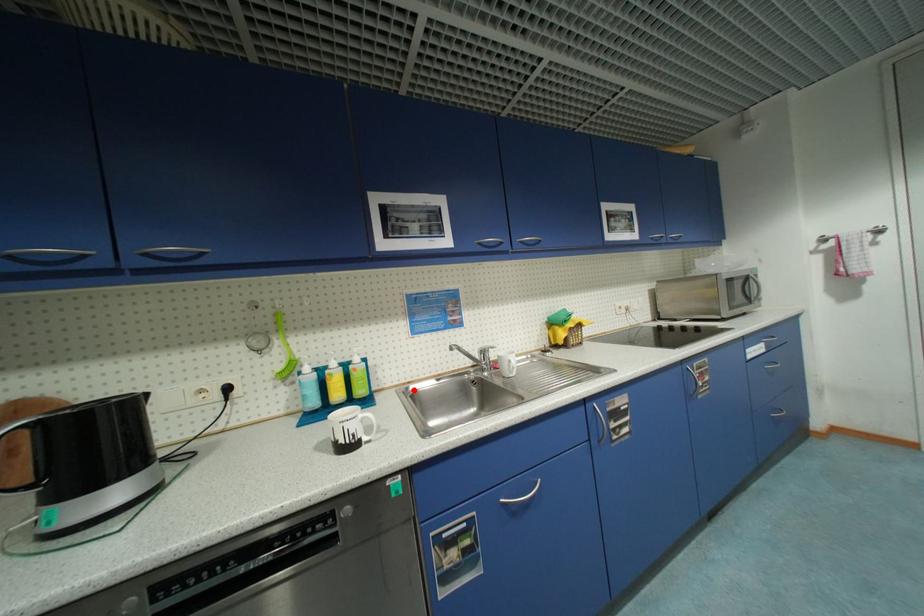
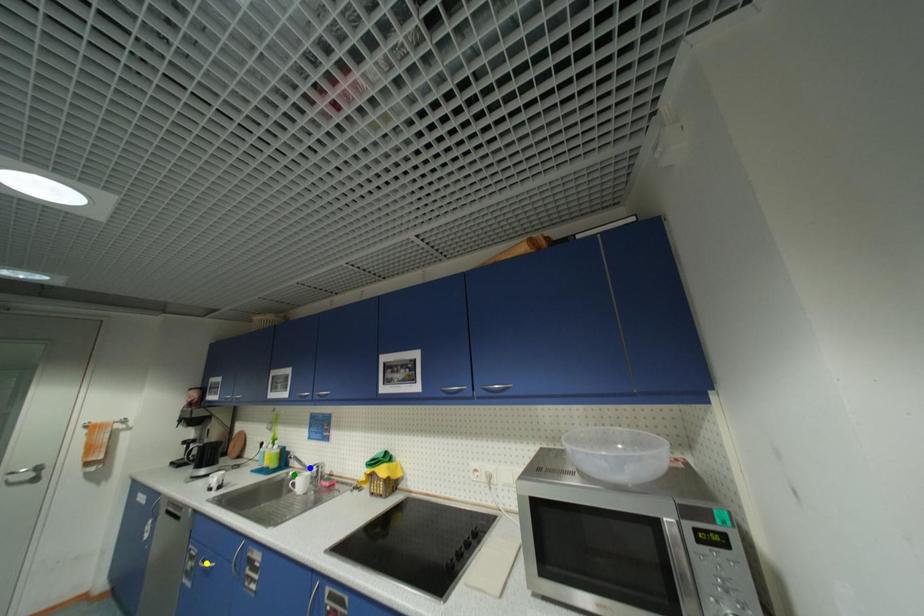
Question: I am providing you with two images of the same scene from different viewpoints. A red point is marked on the first image. You are given multiple points on the second image. Can you choose the point in image 2 that corresponds to the point in image 1?

Choices:
 (A) blue point
 (B) green point
 (C) yellow point

Answer: (B)